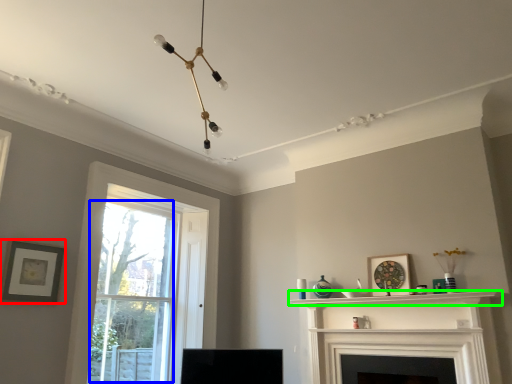
Question: Which object is the farthest from picture frame (highlighted by a red box)? Choose among these: bay window (highlighted by a blue box) or shelf (highlighted by a green box).

Choices:
 (A) bay window
 (B) shelf

Answer: (B)